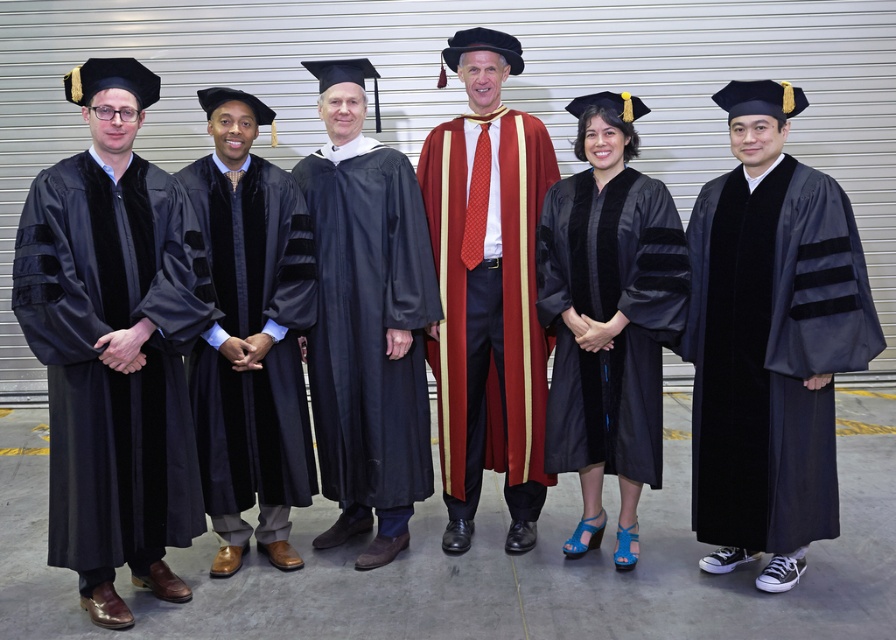
Consider the image. You are standing at the point marked as point (421, 376) in the image, which is 3.09 meters away from the camera. You want to take a photo of the group of six people in academic regalia. Can you fit all six people into your camera frame if your camera has a 45 degree field of view?

Since the point (421, 376) is 3.09 meters away from the camera, and assuming the camera has a 45 degree field of view, the horizontal field of view would be approximately 4.7 meters wide at that distance. Given the group is arranged in a slightly staggered formation and the image shows them all within the scene, it is likely that all six people can fit into the camera frame.